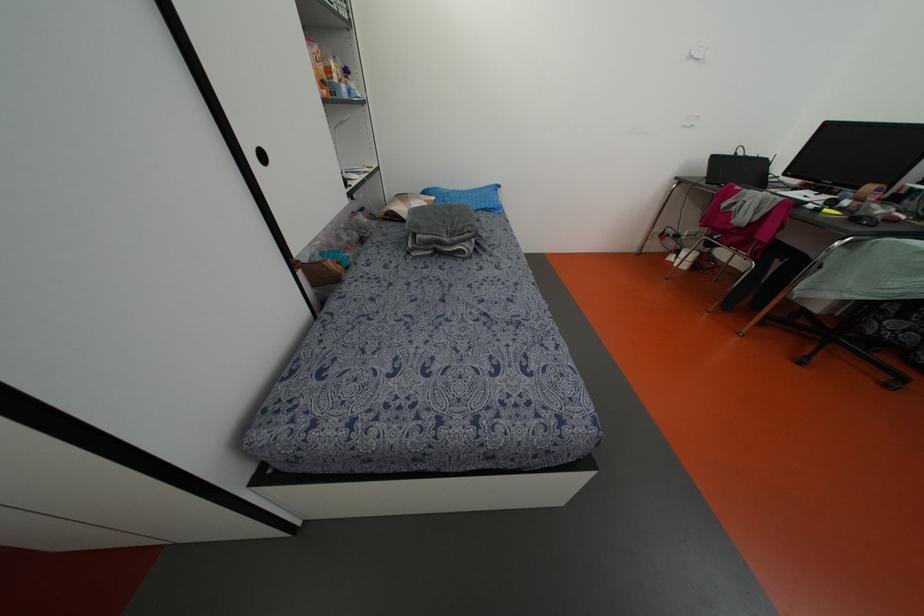
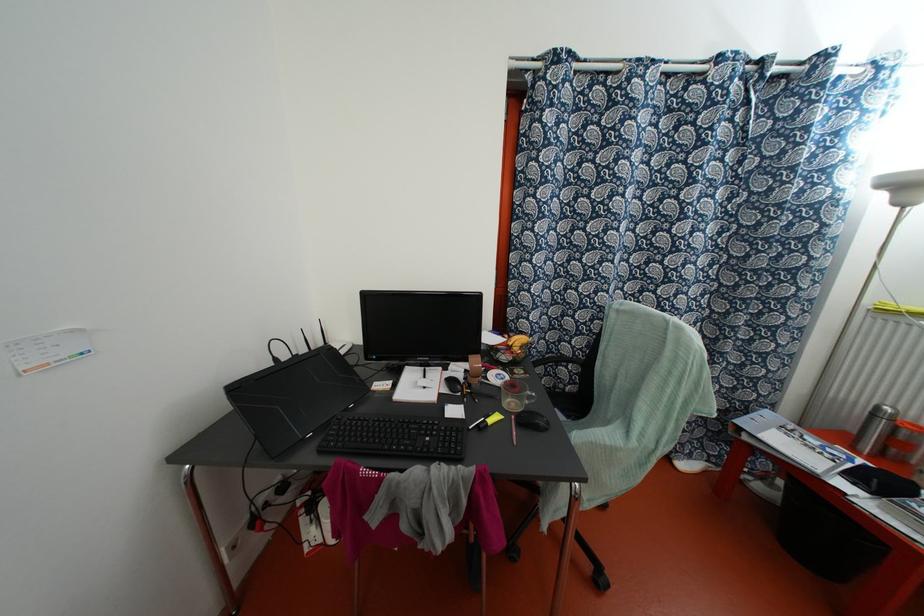
Find the pixel in the second image that matches (800,195) in the first image.

(418, 386)